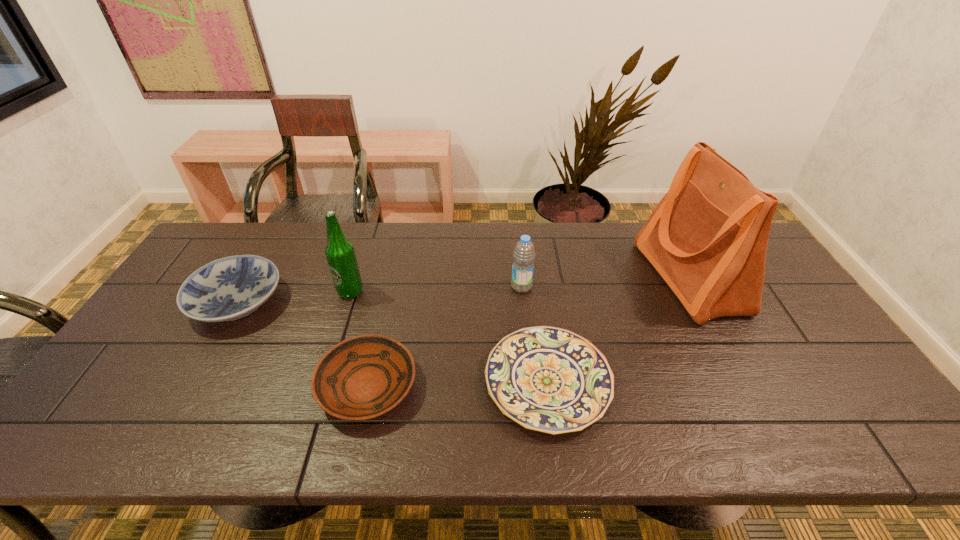
At what (x,y) coordinates should I click in order to perform the action: click on the tallest object. Please return your answer as a coordinate pair (x, y). The width and height of the screenshot is (960, 540). Looking at the image, I should click on (707, 237).

Identify the location of the rightmost object. This screenshot has height=540, width=960. (707, 237).

At what (x,y) coordinates should I click in order to perform the action: click on the fifth shortest object. Please return your answer as a coordinate pair (x, y). This screenshot has width=960, height=540. Looking at the image, I should click on (340, 253).

The width and height of the screenshot is (960, 540). I want to click on water bottle, so click(524, 254).

Identify the location of the tallest plate. The height and width of the screenshot is (540, 960). (226, 289).

Identify the location of the leftmost plate. (226, 289).

Locate an element on the screen. This screenshot has height=540, width=960. the second plate from left to right is located at coordinates (363, 377).

Where is `the fifth tallest object`? Image resolution: width=960 pixels, height=540 pixels. the fifth tallest object is located at coordinates (363, 377).

Identify the location of the shortest object. (552, 380).

The height and width of the screenshot is (540, 960). I want to click on the rightmost plate, so click(552, 380).